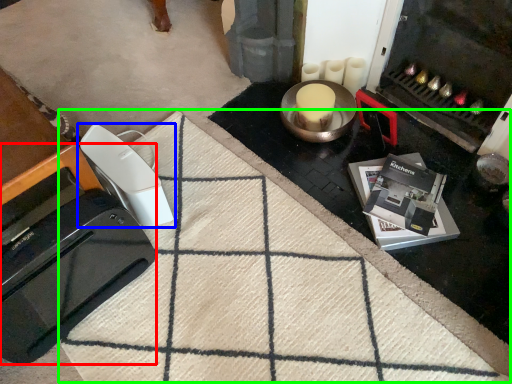
Question: Which object is the closest to the home appliance (highlighted by a red box)? Choose among these: home appliance (highlighted by a blue box) or doormat (highlighted by a green box).

Choices:
 (A) home appliance
 (B) doormat

Answer: (A)